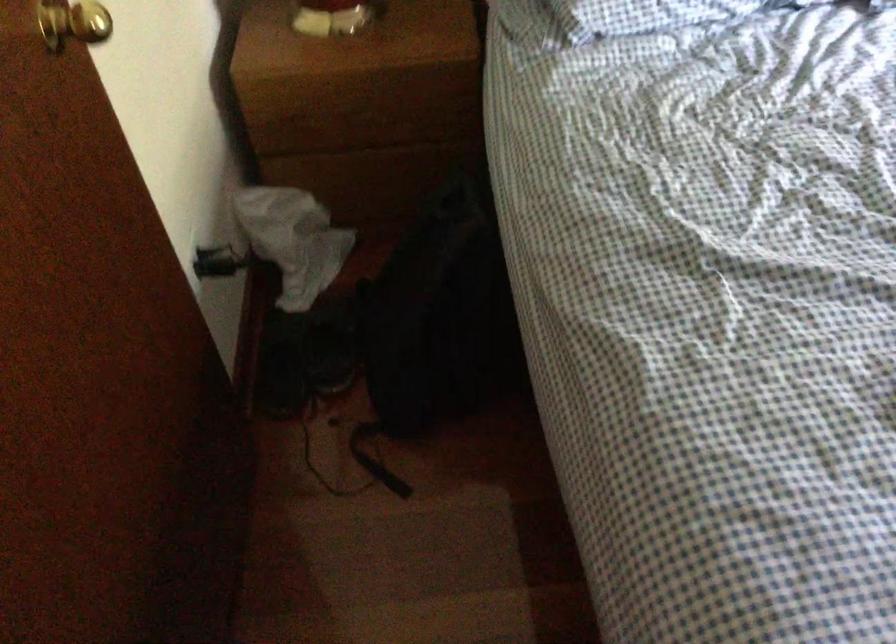
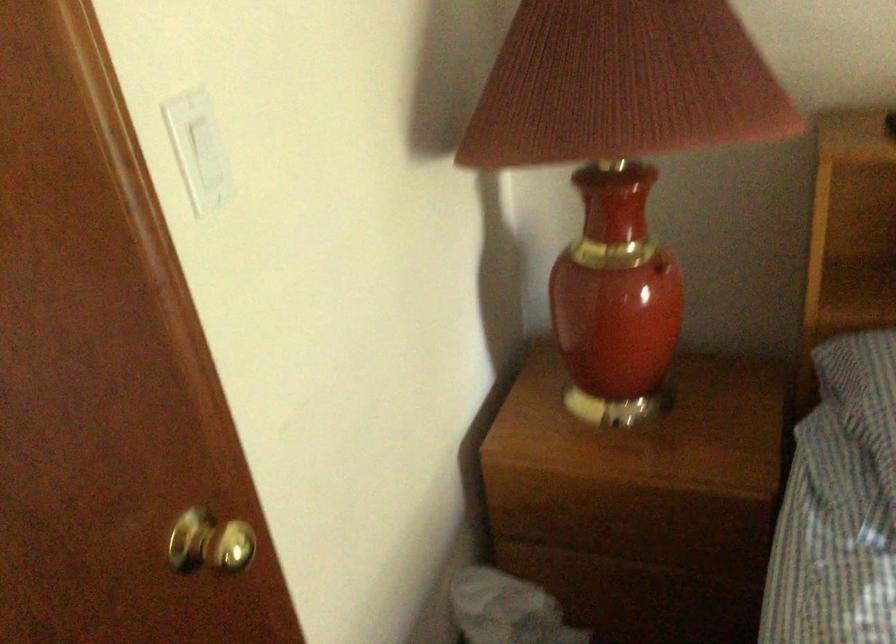
Question: The first image is from the beginning of the video and the second image is from the end. How did the camera likely rotate when shooting the video?

Choices:
 (A) Left
 (B) Right
 (C) Up
 (D) Down

Answer: (A)